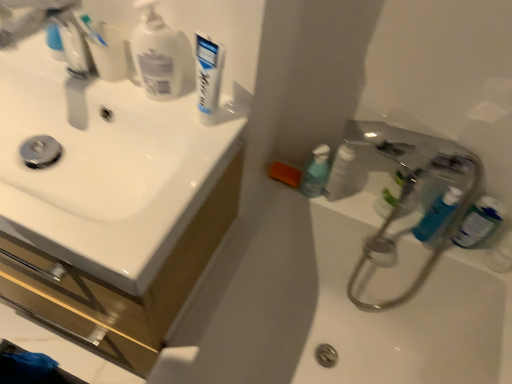
Question: Considering their positions, is white matte pump bottle at upper left located in front of or behind blue glossy bottle at right, the 1th toiletry positioned from the right?

Choices:
 (A) behind
 (B) front

Answer: (B)

Question: In terms of size, does white matte pump bottle at upper left appear bigger or smaller than blue glossy bottle at right, the 1th toiletry positioned from the right?

Choices:
 (A) small
 (B) big

Answer: (A)

Question: Which of these objects is positioned farthest from the white glossy sink at upper left?

Choices:
 (A) blue plastic mouthwash at right, marked as the third mouthwash in a left-to-right arrangement
 (B) green translucent bottle at upper right, the second mouthwash positioned from the left
 (C) white glossy sink at upper left
 (D) white glossy bath at lower right
 (E) blue translucent bottle at right, which is the 2th toiletry from left to right

Answer: (A)

Question: Which object is the closest to the blue glossy bottle at right, the 1th toiletry positioned from the right?

Choices:
 (A) white matte pump bottle at upper left
 (B) white glossy bath at lower right
 (C) white glossy toothpaste at upper center
 (D) white glossy sink at upper left
 (E) green translucent bottle at upper right, placed as the 2th mouthwash when sorted from right to left

Answer: (E)